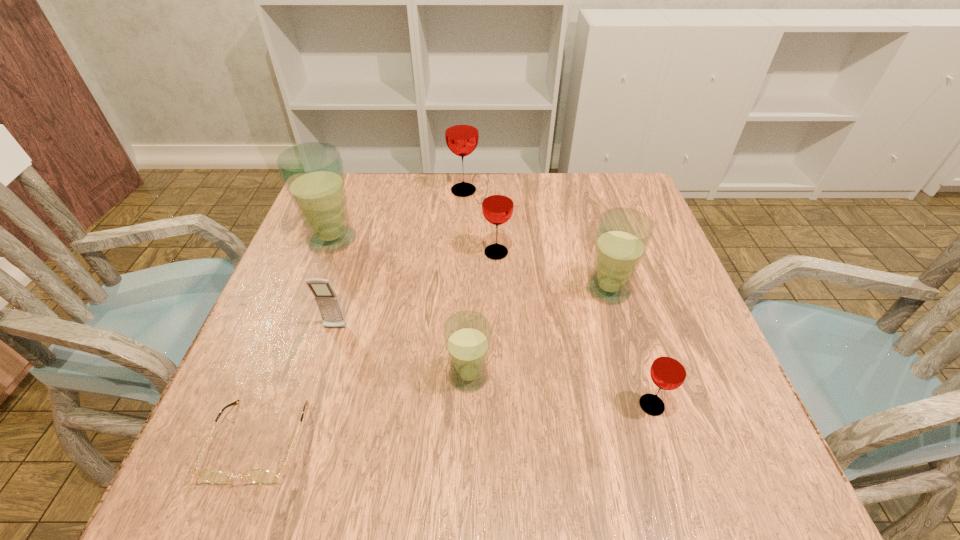
Image resolution: width=960 pixels, height=540 pixels. Find the location of `the closest blue glass to the second red glass from right to left`. the closest blue glass to the second red glass from right to left is located at coordinates (623, 235).

Where is `vacant space that satisfies the following two spatial constraints: 1. on the front-facing side of the nearest red glass; 2. on the right side of the cellular telephone`? vacant space that satisfies the following two spatial constraints: 1. on the front-facing side of the nearest red glass; 2. on the right side of the cellular telephone is located at coordinates (312, 405).

Identify the location of vacant area in the image that satisfies the following two spatial constraints: 1. on the front side of the farthest glass; 2. on the right side of the second smallest blue glass. (459, 289).